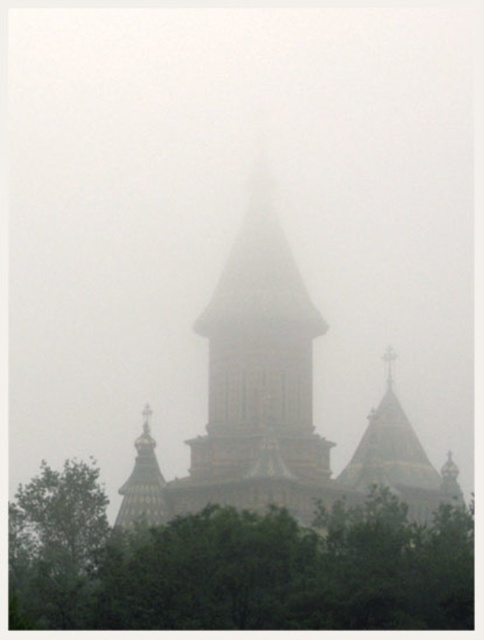
You are an architect evaluating the spatial compatibility of two structures in a foggy European city scene. Given the golden mosaic temple at center and the brown stone bell tower at center, which structure occupies more visual space in the composition?

The golden mosaic temple at center has a larger size compared to the brown stone bell tower at center, so it occupies more visual space in the composition.

Based on the photo, you are standing at the camera position and want to walk towards the green leafy tree at lower center. How far in feet will you have to walk to reach it?

The green leafy tree at lower center is 324.09 feet away from the camera, so you will have to walk 324.09 feet to reach it.